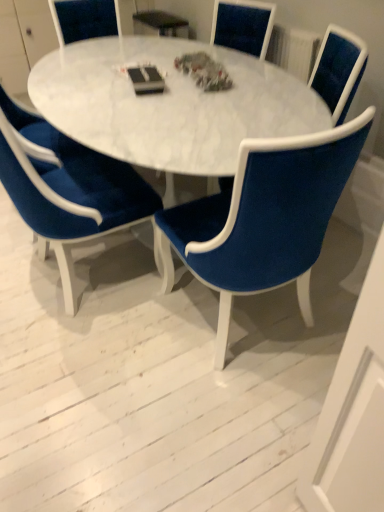
Question: Which direction should I rotate to look at velvet blue chair at center, which is the third chair from left to right?

Choices:
 (A) right
 (B) left

Answer: (A)

Question: Could you tell me if velvet blue chair at center, the 2th chair from the right, is turned towards velvet blue chair at center, the first chair in the left-to-right sequence?

Choices:
 (A) yes
 (B) no

Answer: (B)

Question: Is velvet blue chair at center, the 2th chair from the right, with velvet blue chair at center, the 3th chair when ordered from right to left?

Choices:
 (A) yes
 (B) no

Answer: (B)

Question: Is velvet blue chair at center, the 2th chair from the right, shorter than velvet blue chair at center, the 3th chair when ordered from right to left?

Choices:
 (A) yes
 (B) no

Answer: (B)

Question: Can you confirm if velvet blue chair at center, the 2th chair from the right, is wider than velvet blue chair at center, the 3th chair when ordered from right to left?

Choices:
 (A) yes
 (B) no

Answer: (B)

Question: Considering the relative sizes of velvet blue chair at center, which is the 2th chair in left-to-right order, and velvet blue chair at center, the 3th chair when ordered from right to left, in the image provided, is velvet blue chair at center, which is the 2th chair in left-to-right order, thinner than velvet blue chair at center, the 3th chair when ordered from right to left,?

Choices:
 (A) yes
 (B) no

Answer: (A)

Question: From a real-world perspective, is velvet blue chair at center, which is the 2th chair in left-to-right order, positioned over velvet blue chair at center, the 3th chair when ordered from right to left, based on gravity?

Choices:
 (A) yes
 (B) no

Answer: (B)

Question: Can you see white marble table at center touching white marble table at center?

Choices:
 (A) yes
 (B) no

Answer: (A)

Question: Is white marble table at center oriented away from white marble table at center?

Choices:
 (A) no
 (B) yes

Answer: (A)

Question: From a real-world perspective, is white marble table at center physically below white marble table at center?

Choices:
 (A) no
 (B) yes

Answer: (A)

Question: Considering the relative sizes of white marble table at center and white marble table at center in the image provided, is white marble table at center bigger than white marble table at center?

Choices:
 (A) yes
 (B) no

Answer: (A)

Question: Would you say white marble table at center is part of white marble table at center's contents?

Choices:
 (A) yes
 (B) no

Answer: (B)

Question: Can you confirm if white marble table at center is taller than white marble table at center?

Choices:
 (A) no
 (B) yes

Answer: (B)

Question: Is velvet blue chair at center, the first chair in the left-to-right sequence, positioned with its back to white marble table at center?

Choices:
 (A) no
 (B) yes

Answer: (A)